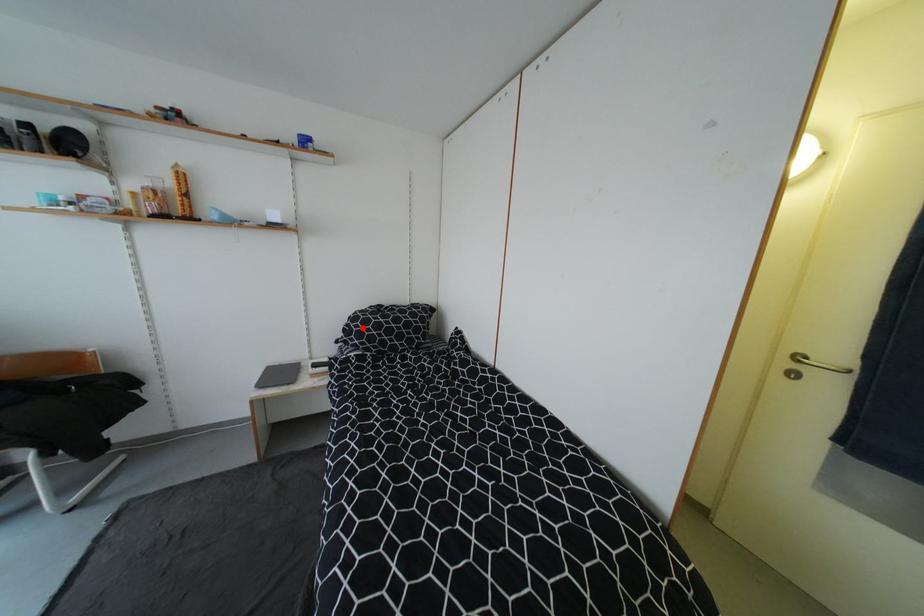
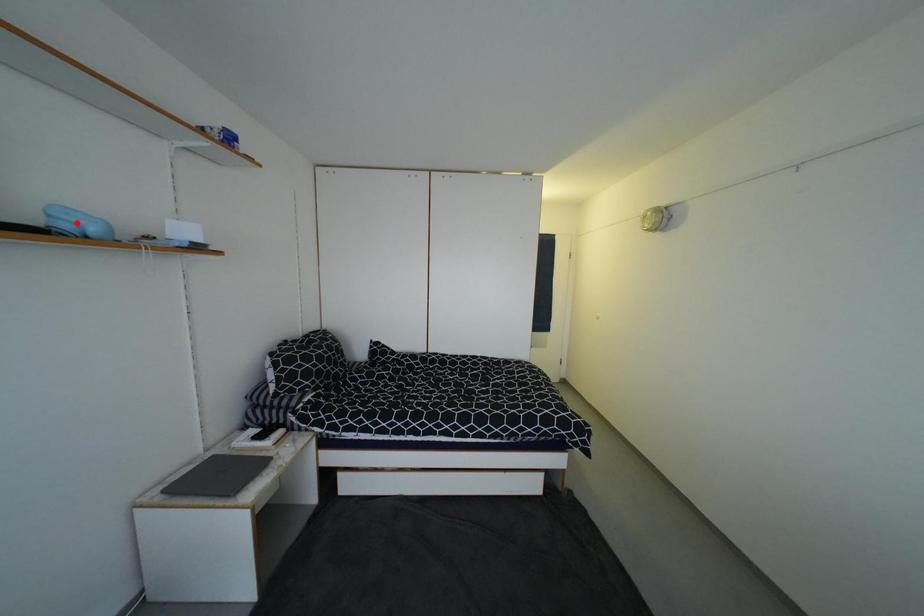
I am providing you with two images of the same scene from different viewpoints. A red point is marked on the first image and another point is marked on the second image. Are the points marked in image1 and image2 representing the same 3D position?

No